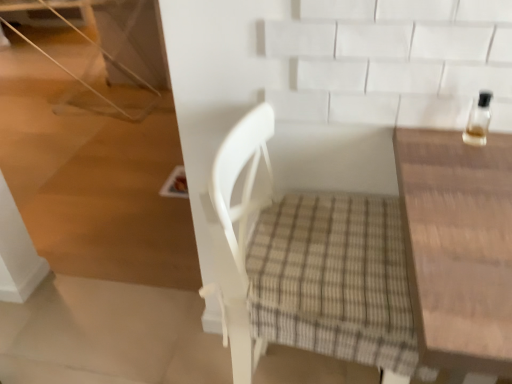
The height and width of the screenshot is (384, 512). Identify the location of vacant area that is in front of clear glass bottle at upper right. (475, 176).